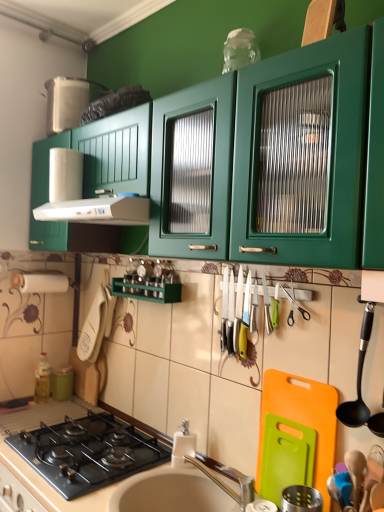
Question: Considering the positions of black glass gas stove at lower left and green matte canister at lower left, the 3th appliance when ordered from front to back, in the image, is black glass gas stove at lower left taller or shorter than green matte canister at lower left, the 3th appliance when ordered from front to back,?

Choices:
 (A) tall
 (B) short

Answer: (B)

Question: Considering their positions, is black glass gas stove at lower left located in front of or behind green matte canister at lower left, which appears as the 1th appliance when viewed from the left?

Choices:
 (A) behind
 (B) front

Answer: (B)

Question: Based on their relative distances, which object is nearer to the green plastic cutting board at lower right, the 2th appliance from the left?

Choices:
 (A) wooden spoon at lower right, marked as the 2th utensil in a top-to-bottom arrangement
 (B) black glass gas stove at lower left
 (C) black plastic spoon at right, which ranks as the second utensil in bottom-to-top order
 (D) green matte cabinet at upper center
 (E) beige matte countertop at lower center

Answer: (A)

Question: Estimate the real-world distances between objects in this image. Which object is farther from the silver metallic faucet at sink center?

Choices:
 (A) black plastic spoon at right, which ranks as the second utensil in bottom-to-top order
 (B) beige matte countertop at lower center
 (C) black glass gas stove at lower left
 (D) wooden spoon at lower right, marked as the 2th utensil in a top-to-bottom arrangement
 (E) blue rubber spatula at lower right, which is counted as the first appliance, starting from the front

Answer: (B)